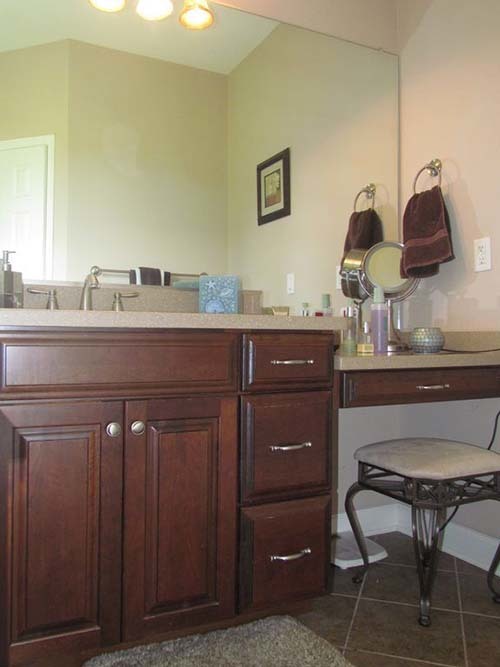
The image size is (500, 667). I want to click on chair legs, so click(346, 506), click(414, 547), click(490, 571).